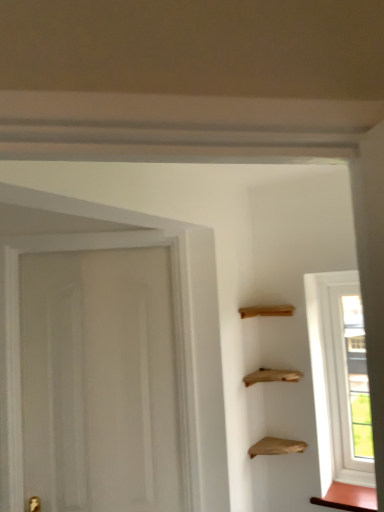
Question: From a real-world perspective, relative to transparent glass window at right, is matte brown cabinet at lower right, which ranks as the 2th cabinetry in left-to-right order, vertically above or below?

Choices:
 (A) below
 (B) above

Answer: (A)

Question: Considering the positions of matte brown cabinet at lower right, which is the 1th cabinetry in bottom-to-top order, and transparent glass window at right in the image, is matte brown cabinet at lower right, which is the 1th cabinetry in bottom-to-top order, wider or thinner than transparent glass window at right?

Choices:
 (A) wide
 (B) thin

Answer: (A)

Question: Which is farther from the wooden shelves at upper right, which appears as the second cabinetry when ordered from the bottom?

Choices:
 (A) transparent glass window at right
 (B) matte brown cabinet at lower right, which is the 1th cabinetry in bottom-to-top order

Answer: (B)

Question: Which is nearer to the matte brown cabinet at lower right, marked as the first cabinetry in a right-to-left arrangement?

Choices:
 (A) transparent glass window at right
 (B) wooden shelves at upper right, which appears as the second cabinetry when ordered from the bottom

Answer: (A)